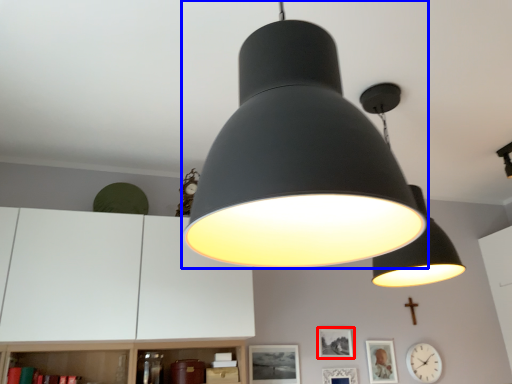
Question: Which object appears closest to the camera in this image, picture frame (highlighted by a red box) or lamp (highlighted by a blue box)?

Choices:
 (A) picture frame
 (B) lamp

Answer: (B)